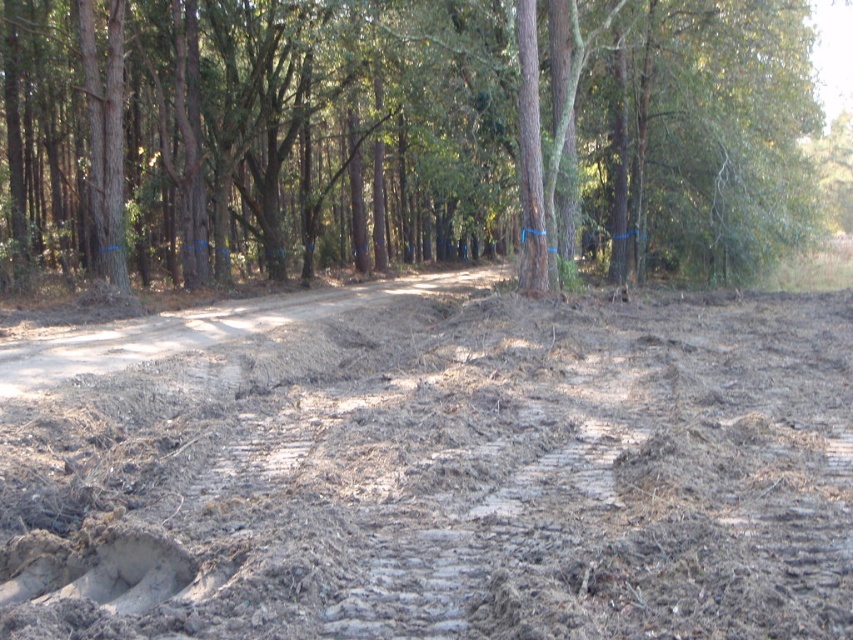
Question: Estimate the real-world distances between objects in this image. Which object is closer to the brown rough tree at center?

Choices:
 (A) dull brown mud at center
 (B) dirt road at center

Answer: (B)

Question: Which point appears closest to the camera in this image?

Choices:
 (A) (592, 435)
 (B) (64, 358)
 (C) (490, 188)

Answer: (A)

Question: Is dull brown mud at center to the right of brown rough tree at center from the viewer's perspective?

Choices:
 (A) yes
 (B) no

Answer: (B)

Question: Considering the relative positions of dull brown mud at center and brown rough tree at center in the image provided, where is dull brown mud at center located with respect to brown rough tree at center?

Choices:
 (A) right
 (B) left

Answer: (B)

Question: Which of the following is the closest to the observer?

Choices:
 (A) dull brown mud at center
 (B) dirt road at center
 (C) brown rough tree at center

Answer: (A)

Question: Can you confirm if dull brown mud at center is positioned below dirt road at center?

Choices:
 (A) no
 (B) yes

Answer: (B)